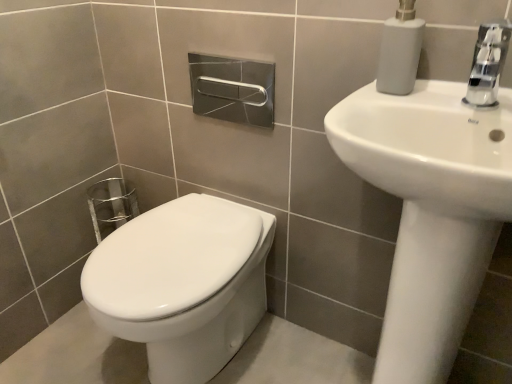
Question: Considering the relative positions of white glossy sink at upper right and white matte soap dispenser at upper right in the image provided, is white glossy sink at upper right to the left of white matte soap dispenser at upper right from the viewer's perspective?

Choices:
 (A) yes
 (B) no

Answer: (B)

Question: From the image's perspective, is white glossy sink at upper right on top of white matte soap dispenser at upper right?

Choices:
 (A) yes
 (B) no

Answer: (B)

Question: Is white glossy sink at upper right oriented away from white matte soap dispenser at upper right?

Choices:
 (A) no
 (B) yes

Answer: (A)

Question: Is white glossy sink at upper right further to the viewer compared to white matte soap dispenser at upper right?

Choices:
 (A) no
 (B) yes

Answer: (A)

Question: Can we say white glossy sink at upper right lies outside white matte soap dispenser at upper right?

Choices:
 (A) no
 (B) yes

Answer: (B)

Question: From the image's perspective, is white glossy toilet at lower left located above or below chrome metallic faucet at upper right?

Choices:
 (A) below
 (B) above

Answer: (A)

Question: Considering the positions of white glossy toilet at lower left and chrome metallic faucet at upper right in the image, is white glossy toilet at lower left wider or thinner than chrome metallic faucet at upper right?

Choices:
 (A) wide
 (B) thin

Answer: (A)

Question: Is white glossy toilet at lower left in front of or behind chrome metallic faucet at upper right in the image?

Choices:
 (A) behind
 (B) front

Answer: (A)

Question: From a real-world perspective, is white glossy toilet at lower left above or below chrome metallic faucet at upper right?

Choices:
 (A) above
 (B) below

Answer: (B)

Question: From the image's perspective, is white glossy toilet at lower left above or below white matte soap dispenser at upper right?

Choices:
 (A) above
 (B) below

Answer: (B)

Question: Considering the positions of white glossy toilet at lower left and white matte soap dispenser at upper right in the image, is white glossy toilet at lower left bigger or smaller than white matte soap dispenser at upper right?

Choices:
 (A) big
 (B) small

Answer: (A)

Question: Do you think white glossy toilet at lower left is within white matte soap dispenser at upper right, or outside of it?

Choices:
 (A) outside
 (B) inside

Answer: (A)

Question: Is white glossy toilet at lower left taller or shorter than white matte soap dispenser at upper right?

Choices:
 (A) tall
 (B) short

Answer: (A)

Question: Is white matte soap dispenser at upper right spatially inside chrome metallic faucet at upper right, or outside of it?

Choices:
 (A) inside
 (B) outside

Answer: (B)

Question: Considering the positions of point click(x=415, y=66) and point click(x=488, y=24), is point click(x=415, y=66) closer or farther from the camera than point click(x=488, y=24)?

Choices:
 (A) closer
 (B) farther

Answer: (B)